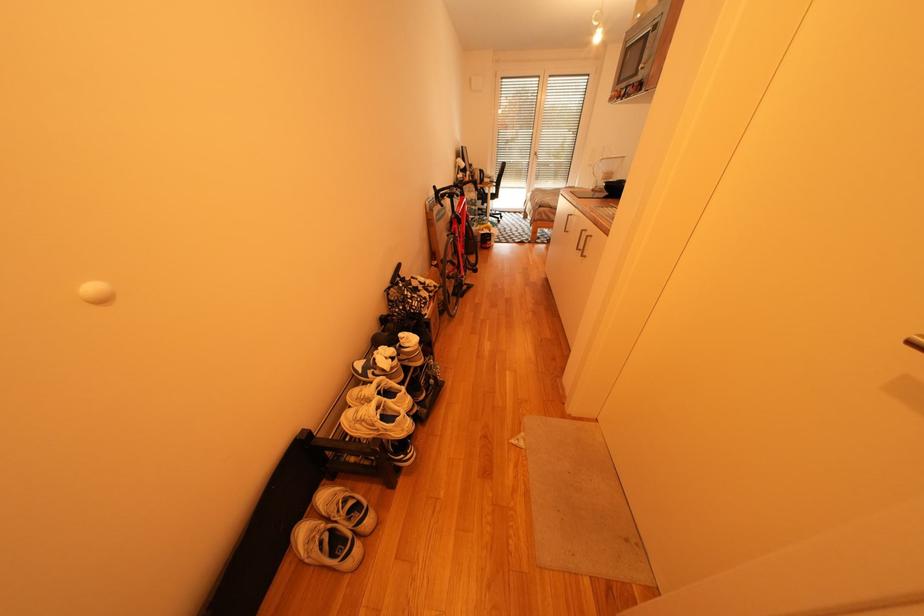
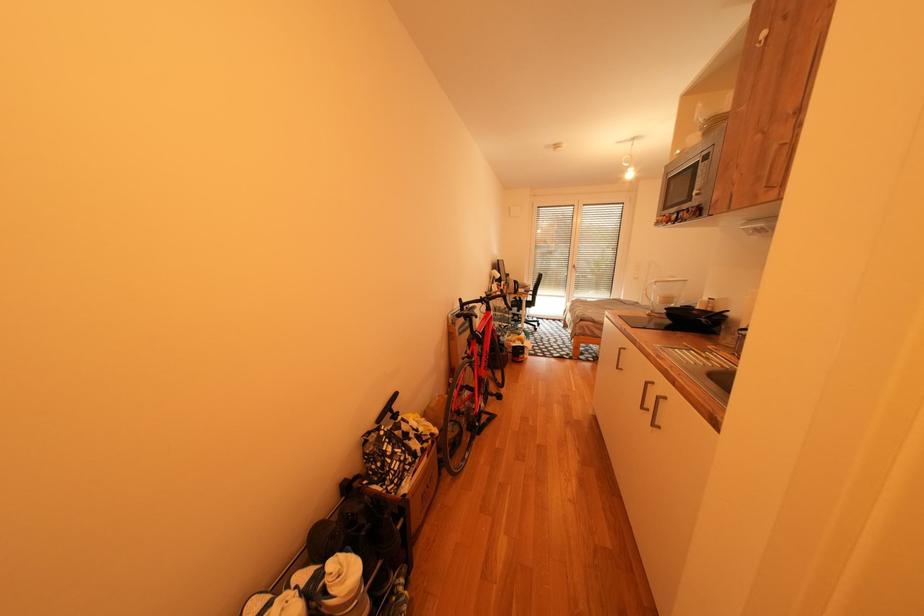
The images are taken continuously from a first-person perspective. In which direction are you moving?

The movement direction of the cameraman is right, forward.